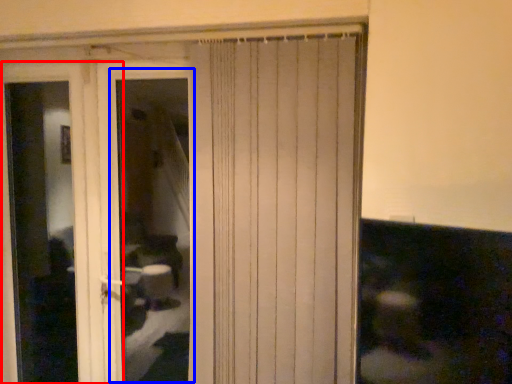
Question: Which object is further to the camera taking this photo, screen door (highlighted by a red box) or window (highlighted by a blue box)?

Choices:
 (A) screen door
 (B) window

Answer: (A)